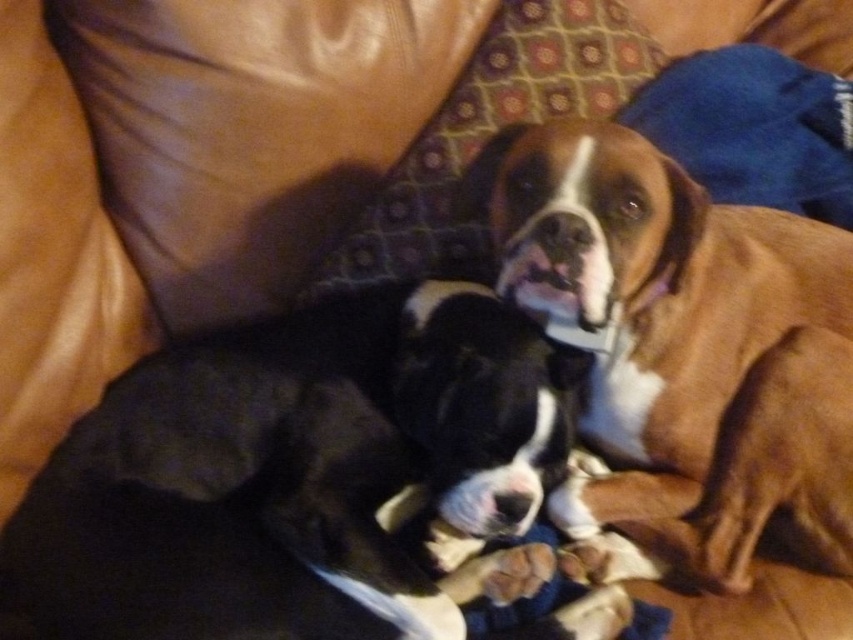
Question: Does brown smooth dog at upper right have a greater width compared to brown fuzzy paw at lower center?

Choices:
 (A) no
 (B) yes

Answer: (B)

Question: Estimate the real-world distances between objects in this image. Which object is farther from the black smooth dog at center?

Choices:
 (A) brown smooth dog at upper right
 (B) brown fuzzy paw at lower center
 (C) patterned fabric pillow at upper center

Answer: (C)

Question: Which object appears farthest from the camera in this image?

Choices:
 (A) brown smooth dog at upper right
 (B) black smooth dog at center
 (C) brown fuzzy paw at lower center

Answer: (C)

Question: Does brown smooth dog at upper right lie in front of brown fuzzy paw at lower center?

Choices:
 (A) yes
 (B) no

Answer: (A)

Question: Among these objects, which one is farthest from the camera?

Choices:
 (A) brown fuzzy paw at lower center
 (B) black smooth dog at center
 (C) brown smooth dog at upper right
 (D) patterned fabric pillow at upper center

Answer: (D)

Question: From the image, what is the correct spatial relationship of brown smooth dog at upper right in relation to patterned fabric pillow at upper center?

Choices:
 (A) below
 (B) above

Answer: (A)